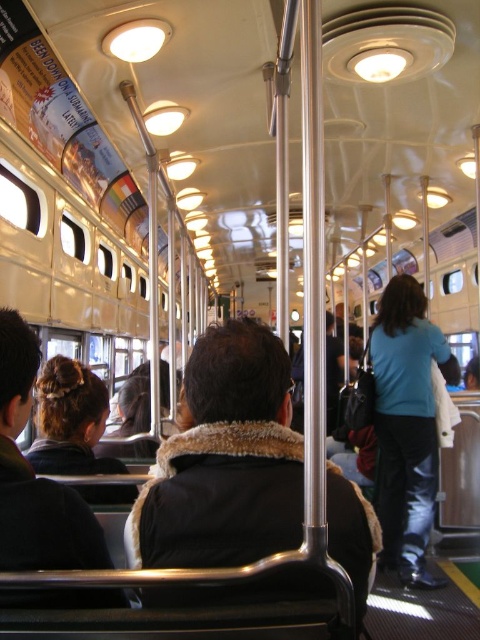
You are a passenger on the public transit vehicle and want to know which of the two points, point (197, 342) or point (387, 506), is closer to you. Based on the image, which point is nearer?

Point (197, 342) is closer to the camera than point (387, 506), so it is nearer to you.